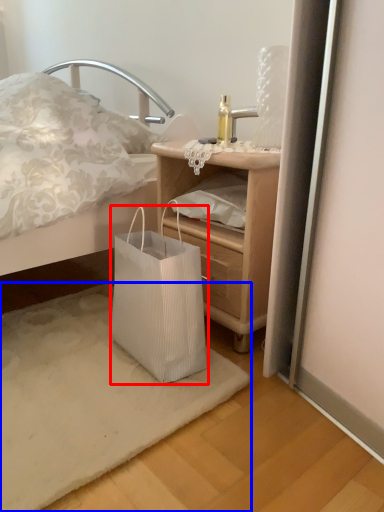
Question: Which object appears farthest to the camera in this image, bag (highlighted by a red box) or mat (highlighted by a blue box)?

Choices:
 (A) bag
 (B) mat

Answer: (A)